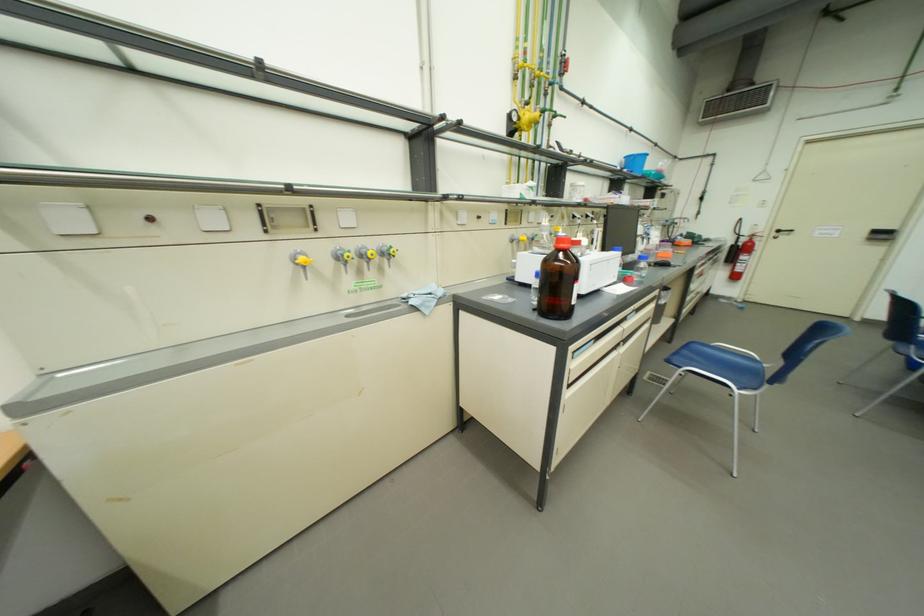
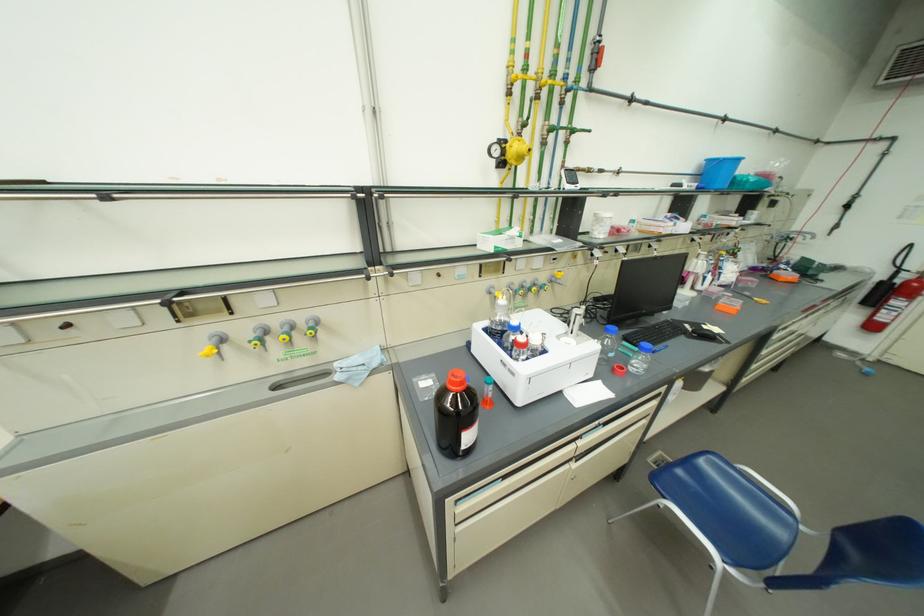
Find the pixel in the second image that matches the point at 747,390 in the first image.

(734, 564)